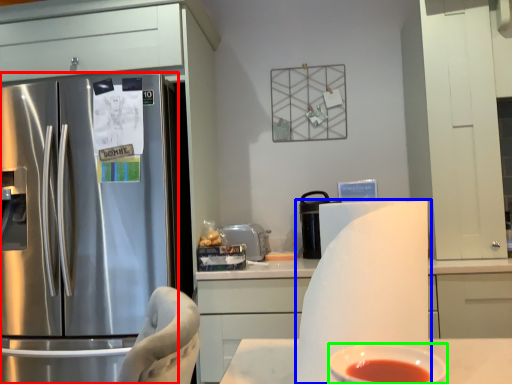
Question: Based on their relative distances, which object is nearer to refrigerator (highlighted by a red box)? Choose from paper towel (highlighted by a blue box) and bowl (highlighted by a green box).

Choices:
 (A) paper towel
 (B) bowl

Answer: (A)